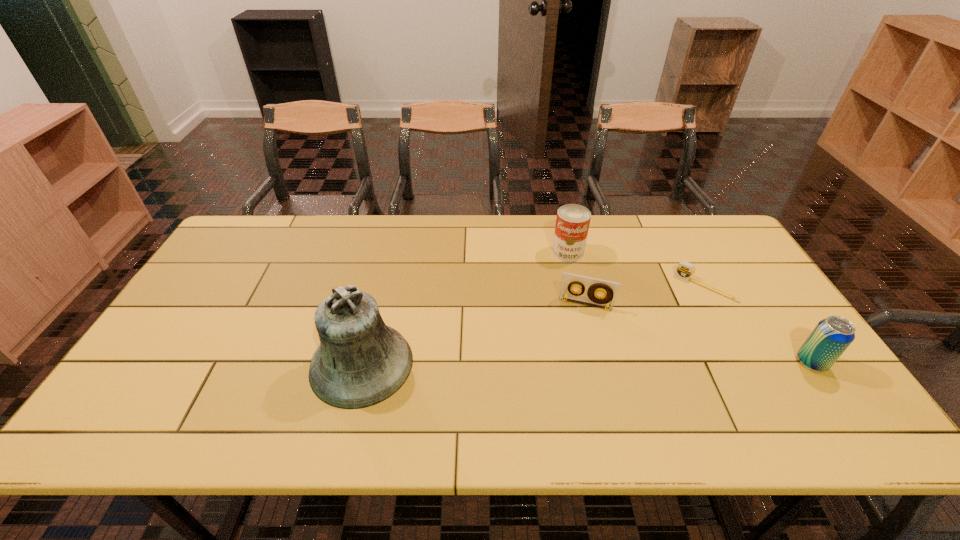
Find the location of a particular element. free space located on the front label of the farthest object is located at coordinates (532, 355).

The image size is (960, 540). Identify the location of free spot located 0.120m on the front label of the farthest object. (556, 287).

Where is `free region located at the front of the videotape with visible reels`? free region located at the front of the videotape with visible reels is located at coordinates (567, 370).

What are the coordinates of `vacant position located at the front of the videotape with visible reels` in the screenshot? It's located at (566, 374).

Identify the location of vacant point located 0.170m at the front of the videotape with visible reels. The height and width of the screenshot is (540, 960). (570, 358).

Image resolution: width=960 pixels, height=540 pixels. Identify the location of vacant area situated 0.280m at the front of the tape measure with the tape extended. (654, 359).

Identify the location of vacant space located 0.100m at the front of the tape measure with the tape extended. (682, 319).

The image size is (960, 540). In order to click on free spot located at the front of the tape measure with the tape extended in this screenshot , I will do `click(680, 321)`.

Locate an element on the screen. This screenshot has height=540, width=960. object present at the far edge is located at coordinates (572, 223).

You are a GUI agent. You are given a task and a screenshot of the screen. Output one action in this format:
    pyautogui.click(x=<x>, y=<y>)
    Task: Click on the bell at the near edge
    
    Given the screenshot: What is the action you would take?
    pyautogui.click(x=360, y=362)